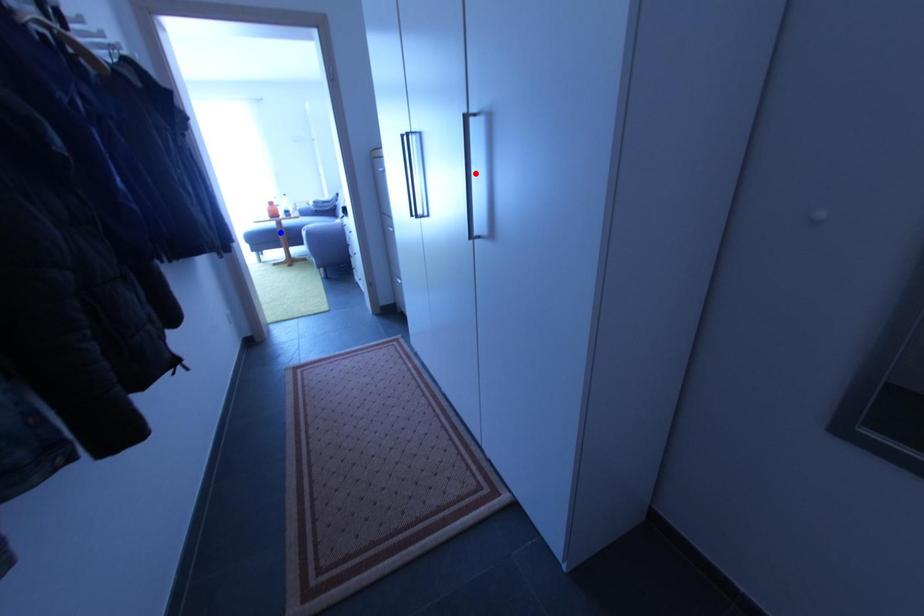
Question: Two points are marked on the image. Which point is closer to the camera?

Choices:
 (A) Blue point is closer.
 (B) Red point is closer.

Answer: (B)